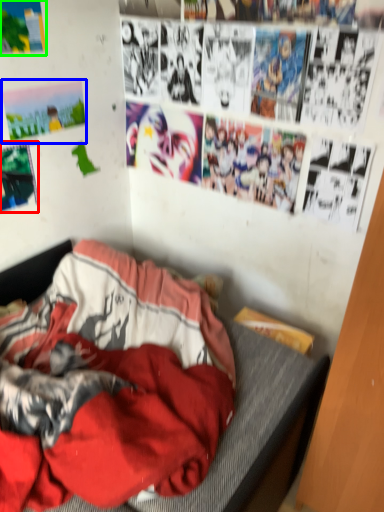
Question: Which object is positioned farthest from poster page (highlighted by a red box)? Select from poster page (highlighted by a blue box) and poster page (highlighted by a green box).

Choices:
 (A) poster page
 (B) poster page

Answer: (B)